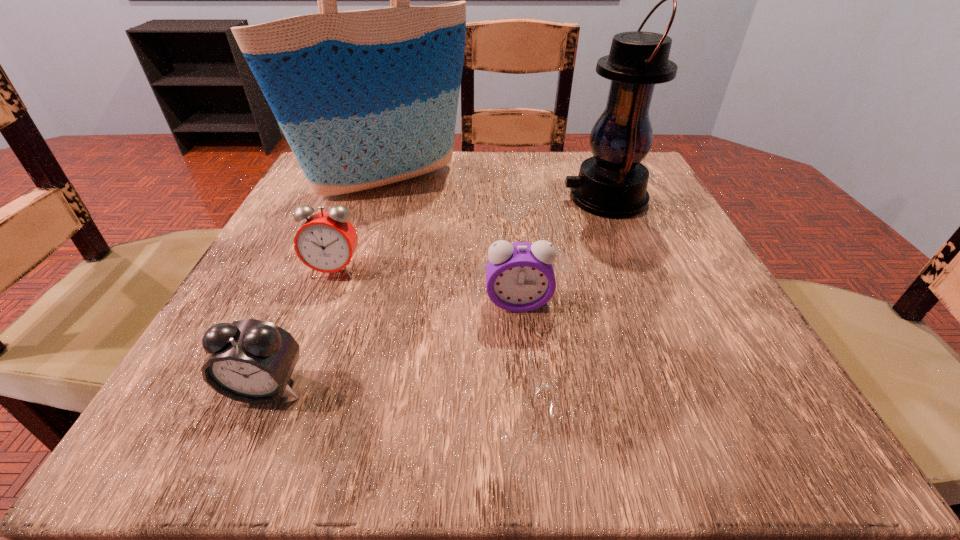
Find the location of a particular element. The width and height of the screenshot is (960, 540). object that is at the far right corner is located at coordinates (613, 183).

Locate an element on the screen. The width and height of the screenshot is (960, 540). vacant space at the far edge is located at coordinates (406, 187).

Where is `vacant space at the near edge`? This screenshot has height=540, width=960. vacant space at the near edge is located at coordinates (636, 400).

The height and width of the screenshot is (540, 960). In the image, there is a desktop. Identify the location of vacant space at the left edge. pos(319,328).

The height and width of the screenshot is (540, 960). I want to click on vacant space at the right edge of the desktop, so click(x=723, y=319).

Where is `free space at the far left corner`? The height and width of the screenshot is (540, 960). free space at the far left corner is located at coordinates (365, 191).

Where is `free space at the near right corner of the desktop`? The image size is (960, 540). free space at the near right corner of the desktop is located at coordinates (680, 446).

At what (x,y) coordinates should I click in order to perform the action: click on blank region between the nearest object and the lantern. Please return your answer as a coordinate pair (x, y). The width and height of the screenshot is (960, 540). Looking at the image, I should click on (435, 293).

Locate an element on the screen. vacant point located between the fourth shortest object and the fourth farthest object is located at coordinates (562, 251).

This screenshot has width=960, height=540. Identify the location of vacant space that's between the rightmost alarm clock and the tallest object. (452, 242).